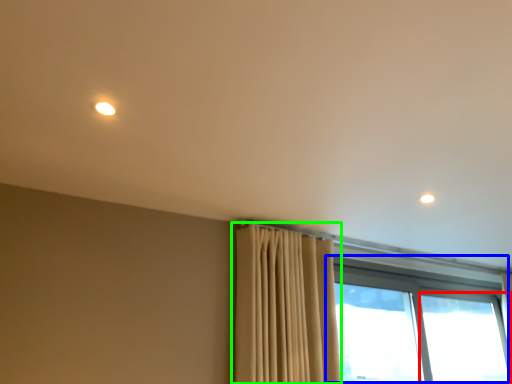
Question: Which is farther away from window (highlighted by a red box)? window (highlighted by a blue box) or curtain (highlighted by a green box)?

Choices:
 (A) window
 (B) curtain

Answer: (B)